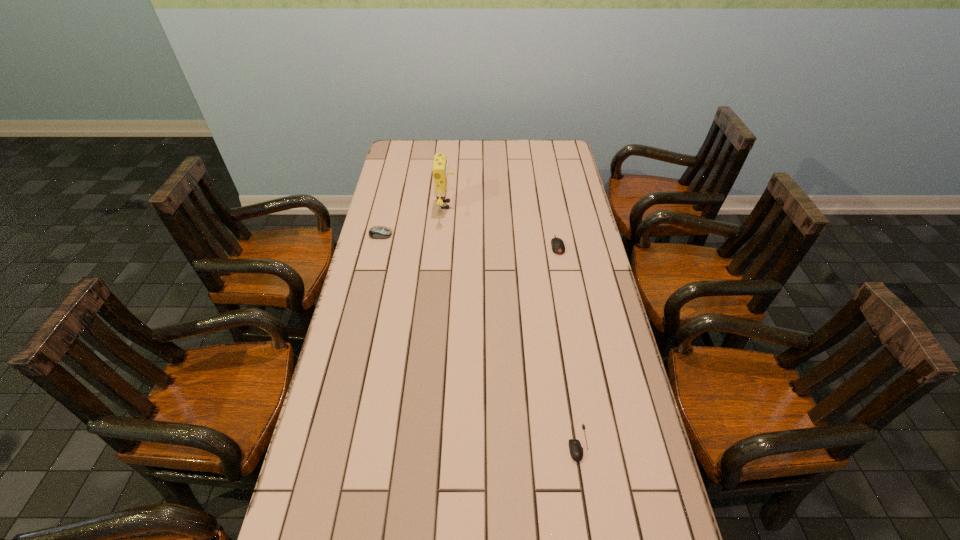
You are a GUI agent. You are given a task and a screenshot of the screen. Output one action in this format:
    pyautogui.click(x=<x>, y=<y>)
    Task: Click on the free spot that satisfies the following two spatial constraints: 1. on the face of the second object from left to right; 2. on the left side of the nearest object
    This screenshot has width=960, height=540.
    Given the screenshot: What is the action you would take?
    pyautogui.click(x=425, y=443)

The height and width of the screenshot is (540, 960). In order to click on vacant space that satisfies the following two spatial constraints: 1. on the face of the nearest object; 2. on the right side of the sponge in this screenshot , I will do `click(425, 443)`.

I want to click on vacant space that satisfies the following two spatial constraints: 1. on the face of the sponge; 2. on the left side of the nearest object, so click(425, 443).